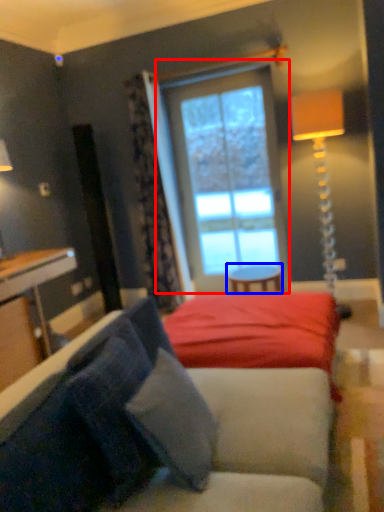
Question: Which of the following is the closest to the observer, window (highlighted by a red box) or table (highlighted by a blue box)?

Choices:
 (A) window
 (B) table

Answer: (B)